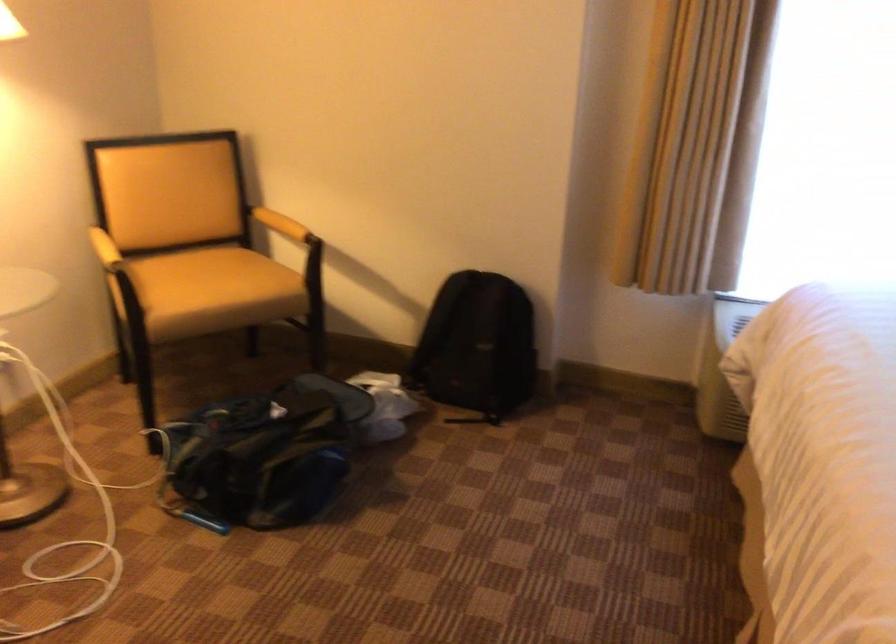
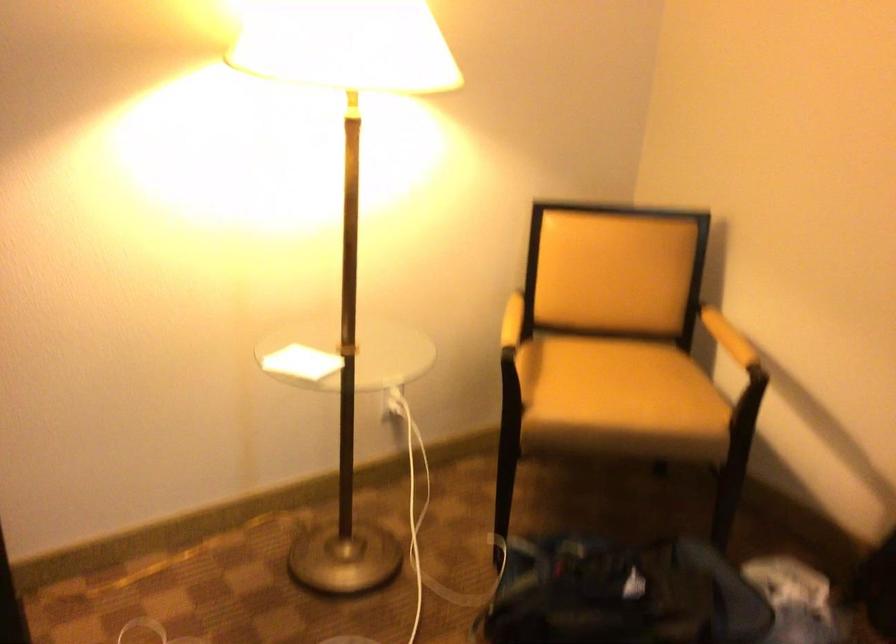
Where in the second image is the point corresponding to point (219, 276) from the first image?

(618, 388)